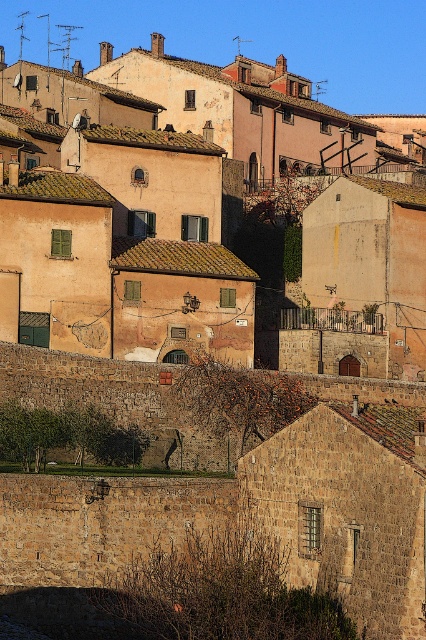
Question: Does rustic stone houses at center have a smaller size compared to brown stone wall at lower left?

Choices:
 (A) no
 (B) yes

Answer: (A)

Question: Can you confirm if rustic stone houses at center is wider than brown stone wall at lower left?

Choices:
 (A) no
 (B) yes

Answer: (B)

Question: Among these objects, which one is nearest to the camera?

Choices:
 (A) brown stone wall at lower left
 (B) rustic stone houses at center

Answer: (A)

Question: Which point is closer to the camera?

Choices:
 (A) brown stone wall at lower left
 (B) rustic stone houses at center

Answer: (A)

Question: Does rustic stone houses at center appear under brown stone wall at lower left?

Choices:
 (A) yes
 (B) no

Answer: (B)